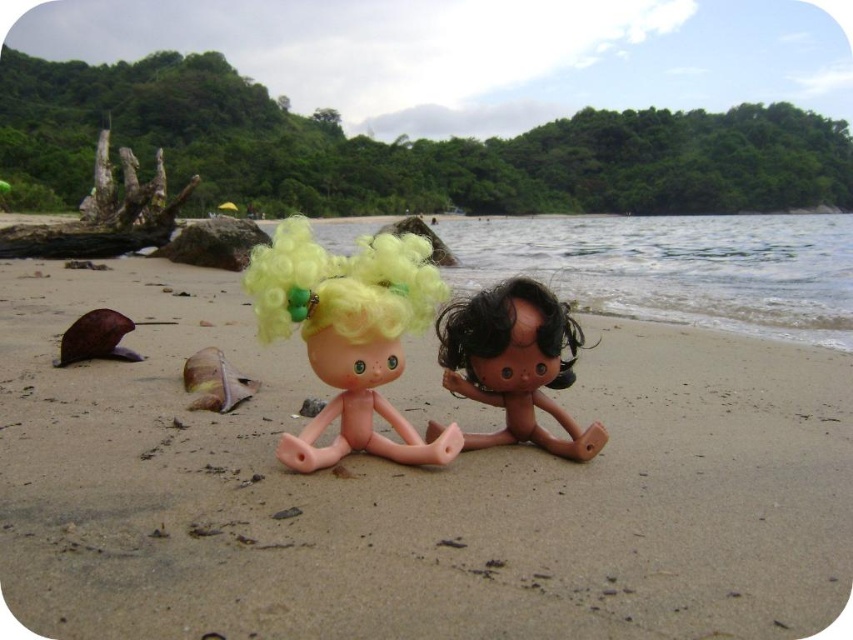
You are a beachcomber searching for items on the beach. You notice the smooth beige sand at center and the pink plastic doll at center. Which object is located beneath the other?

The smooth beige sand at center is positioned under the pink plastic doll at center, so the sand is beneath the doll.

You are a photographer setting up a shot of the beach scene. You want to focus on the smooth beige sand at center and the fluffy yellow hair at center. Which object should you adjust your camera focus to first if you want to ensure both are in focus?

Since the smooth beige sand at center is closer to the viewer than the fluffy yellow hair at center, you should focus on the smooth beige sand at center first to ensure both are in focus.

You are a child playing on the smooth beige sand at center and you want to reach both dolls. Which doll is closer to you?

The dolls are 27.45 inches apart from each other, but the question does not specify their positions relative to the sand, so it is impossible to determine which doll is closer to you based on the given information.